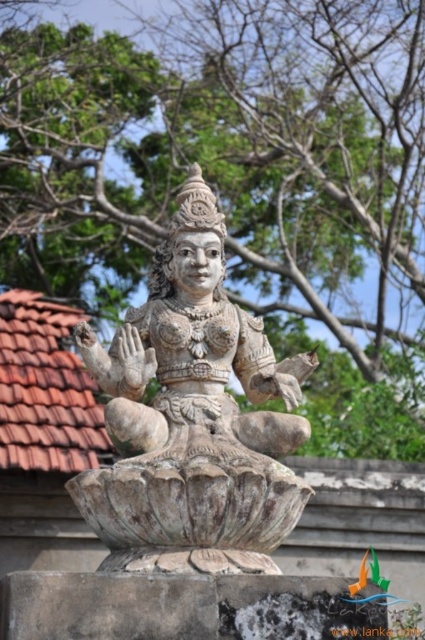
You are a visitor standing in front of the stone statue at center. You want to take a photo of the statue without any obstruction. Is the green leafy tree at upper center blocking your view of the statue?

The green leafy tree at upper center is positioned over the stone statue at center, so it may be blocking part of the statue in your photo.

You are standing in front of the stone statue of a seated deity. There is a green leafy tree at upper center in the image. Can you determine if the tree is positioned to the left or right of the statue?

The green leafy tree at upper center is located at point 0.278 on the x and 0.560 on the y coordinate. Since the tree is at the upper center, it is directly above the statue, not to the left or right.

You are standing in front of the stone statue of a seated deity. There is a point at coordinates (238,177). Can you tell me what object this point is located on?

The point at coordinates (238,177) is located on the green leafy tree at upper center.